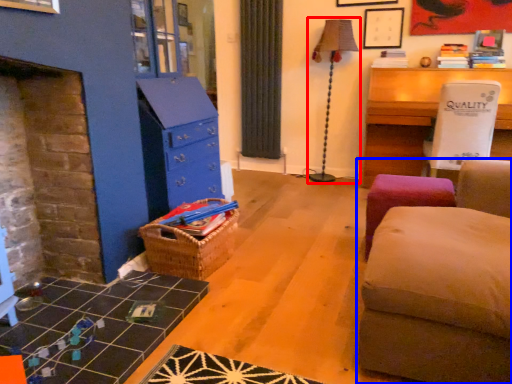
Question: Which object is closer to the camera taking this photo, table lamp (highlighted by a red box) or studio couch (highlighted by a blue box)?

Choices:
 (A) table lamp
 (B) studio couch

Answer: (B)